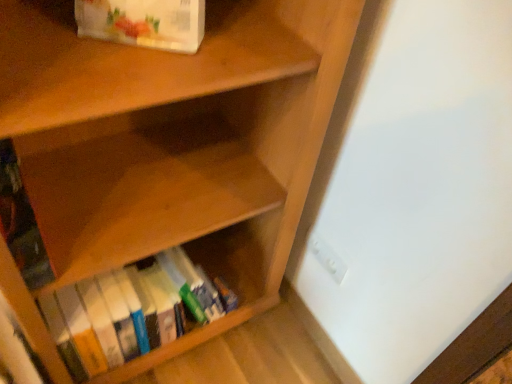
Question: Which direction should I rotate to look at hardcover books at lower center, arranged as the first book when ordered from the bottom?

Choices:
 (A) left
 (B) right

Answer: (A)

Question: Would you say white plastic electric outlet at lower right is a long distance from hardcover books at lower center, arranged as the first book when ordered from the bottom?

Choices:
 (A) yes
 (B) no

Answer: (B)

Question: From the image's perspective, is white plastic electric outlet at lower right located beneath hardcover books at lower center, arranged as the first book when ordered from the bottom?

Choices:
 (A) no
 (B) yes

Answer: (A)

Question: Considering the relative sizes of white plastic electric outlet at lower right and hardcover books at lower center, arranged as the third book when viewed from the top, in the image provided, is white plastic electric outlet at lower right taller than hardcover books at lower center, arranged as the third book when viewed from the top,?

Choices:
 (A) yes
 (B) no

Answer: (B)

Question: From a real-world perspective, is white plastic electric outlet at lower right below hardcover books at lower center, arranged as the third book when viewed from the top?

Choices:
 (A) no
 (B) yes

Answer: (A)

Question: Is white plastic electric outlet at lower right bigger than hardcover books at lower center, arranged as the third book when viewed from the top?

Choices:
 (A) no
 (B) yes

Answer: (A)

Question: Does white plastic electric outlet at lower right have a lesser width compared to hardcover books at lower center, arranged as the third book when viewed from the top?

Choices:
 (A) no
 (B) yes

Answer: (B)

Question: Is white paper bag at upper left, acting as the 3th book starting from the bottom, in contact with hardcover book at left, the second book ordered from the bottom?

Choices:
 (A) yes
 (B) no

Answer: (B)

Question: Would you say hardcover book at left, the second book ordered from the bottom, is part of white paper bag at upper left, which is the first book in top-to-bottom order,'s contents?

Choices:
 (A) no
 (B) yes

Answer: (A)

Question: Does white paper bag at upper left, acting as the 3th book starting from the bottom, have a lesser height compared to hardcover book at left, the second book ordered from the bottom?

Choices:
 (A) no
 (B) yes

Answer: (A)

Question: From a real-world perspective, is white paper bag at upper left, which is the first book in top-to-bottom order, located beneath hardcover book at left, the second book ordered from the bottom?

Choices:
 (A) no
 (B) yes

Answer: (A)

Question: From the image's perspective, is white paper bag at upper left, which is the first book in top-to-bottom order, above hardcover book at left, the second book ordered from the bottom?

Choices:
 (A) yes
 (B) no

Answer: (A)

Question: Is white paper bag at upper left, which is the first book in top-to-bottom order, closer to camera compared to hardcover book at left, positioned as the 2th book in top-to-bottom order?

Choices:
 (A) no
 (B) yes

Answer: (B)

Question: Considering the relative sizes of hardcover books at lower center, arranged as the third book when viewed from the top, and hardcover book at left, the second book ordered from the bottom, in the image provided, is hardcover books at lower center, arranged as the third book when viewed from the top, thinner than hardcover book at left, the second book ordered from the bottom,?

Choices:
 (A) yes
 (B) no

Answer: (A)